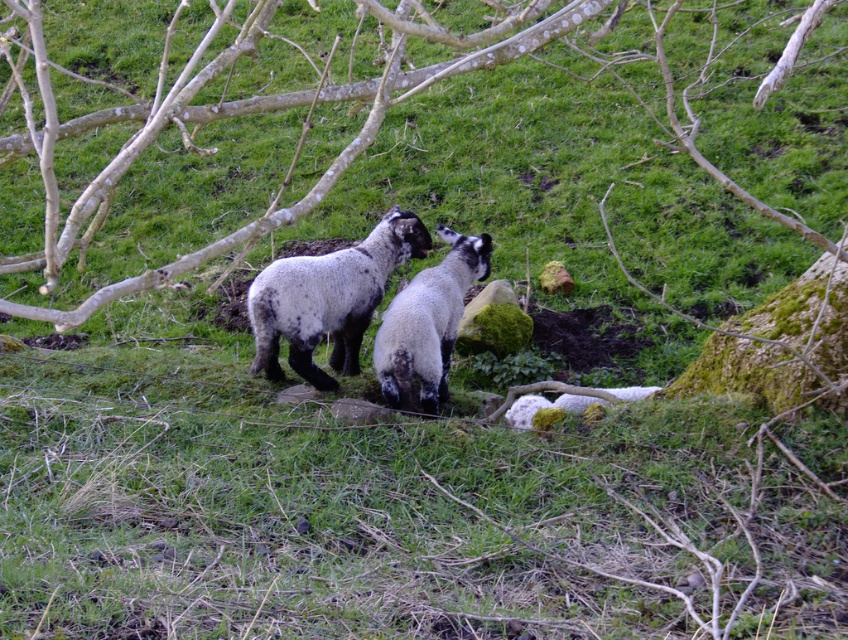
The image size is (848, 640). What do you see at coordinates (328, 298) in the screenshot?
I see `speckled woolen sheep at center` at bounding box center [328, 298].

Does point (266, 333) come farther from viewer compared to point (416, 368)?

That is True.

Where is `speckled woolen sheep at center`? Image resolution: width=848 pixels, height=640 pixels. speckled woolen sheep at center is located at coordinates (328, 298).